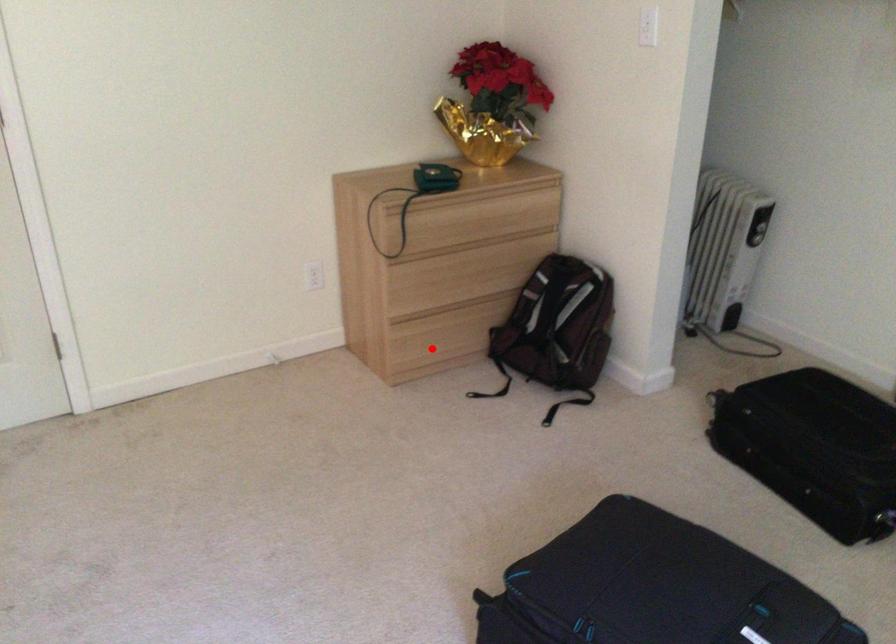
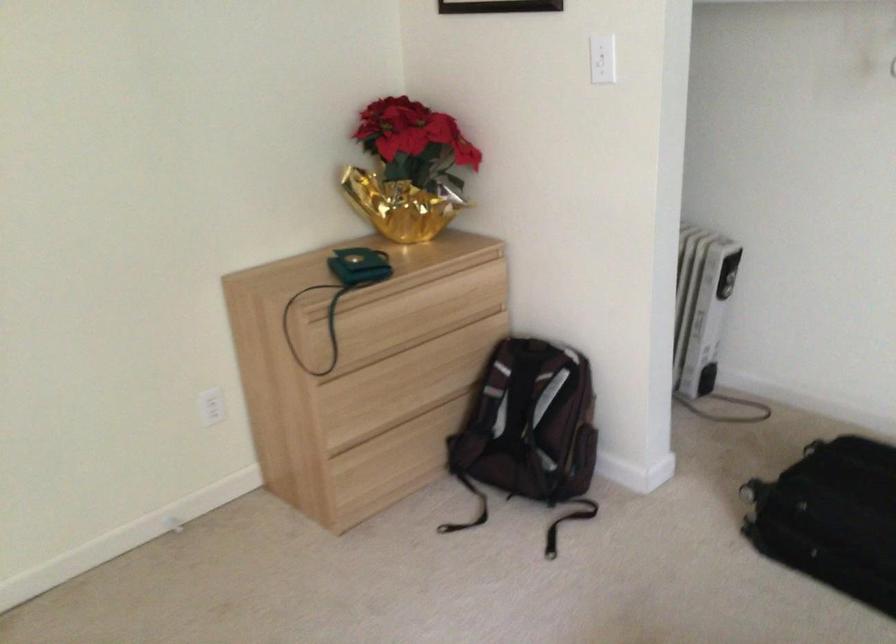
In the second image, find the point that corresponds to the highlighted location in the first image.

(382, 478)